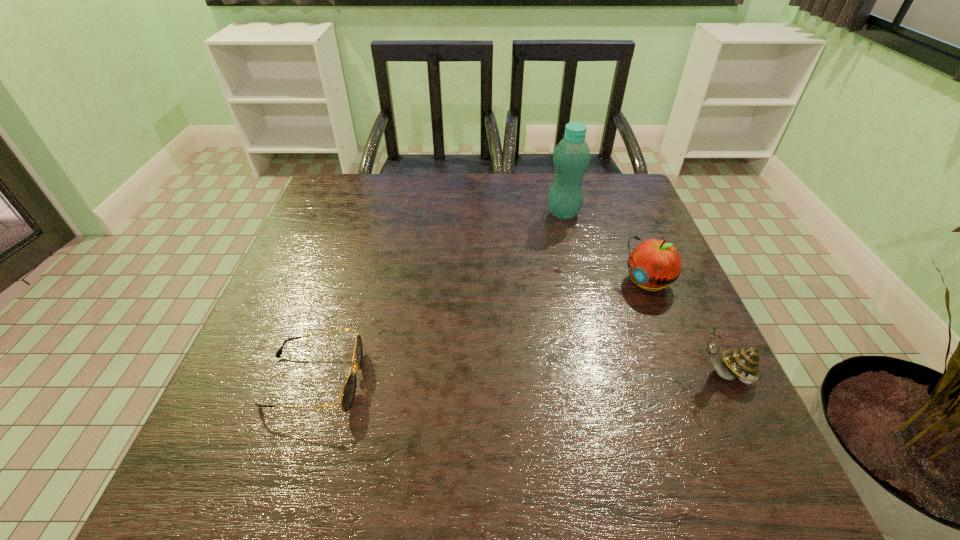
Find the location of `snail at the right edge`. snail at the right edge is located at coordinates (743, 364).

At what (x,y) coordinates should I click in order to perform the action: click on apple that is positioned at the right edge. Please return your answer as a coordinate pair (x, y). The width and height of the screenshot is (960, 540). Looking at the image, I should click on (653, 264).

This screenshot has height=540, width=960. I want to click on object situated at the near left corner, so click(348, 393).

Locate an element on the screen. object that is at the near right corner is located at coordinates pyautogui.click(x=743, y=364).

Locate an element on the screen. vacant space at the far edge of the desktop is located at coordinates [x=530, y=197].

In the image, there is a desktop. In order to click on vacant space at the near edge in this screenshot , I will do `click(530, 395)`.

This screenshot has width=960, height=540. Find the location of `blank space at the left edge`. blank space at the left edge is located at coordinates (255, 334).

Identify the location of vacant area at the right edge of the desktop. (636, 343).

In the image, there is a desktop. Where is `vacant space at the far left corner`? The width and height of the screenshot is (960, 540). vacant space at the far left corner is located at coordinates (365, 213).

This screenshot has width=960, height=540. In order to click on vacant space at the near left corner of the desktop in this screenshot , I will do `click(303, 400)`.